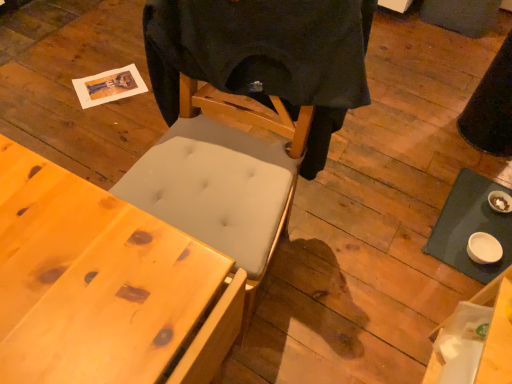
Find the location of a particular element. unoccupied space behind white matte table at lower right is located at coordinates (437, 154).